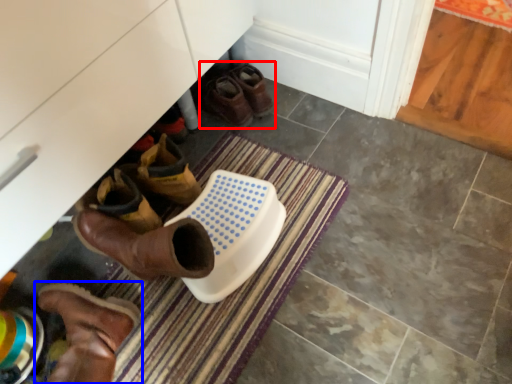
Question: Among these objects, which one is nearest to the camera, footwear (highlighted by a red box) or footwear (highlighted by a blue box)?

Choices:
 (A) footwear
 (B) footwear

Answer: (B)